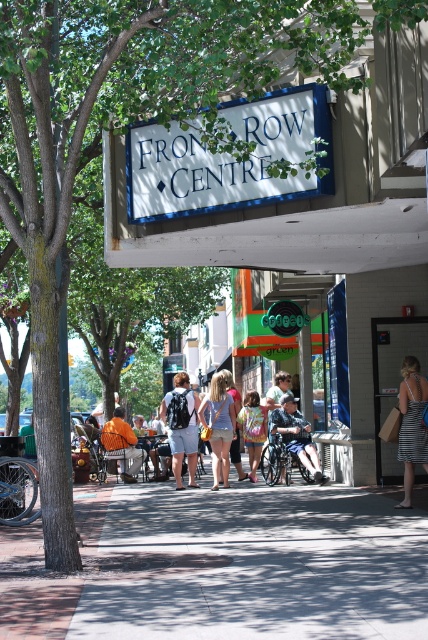
Who is lower down, matte black backpack at center or dark blue fabric wheelchair at center?

Positioned lower is dark blue fabric wheelchair at center.

Between matte black backpack at center and dark blue fabric wheelchair at center, which one appears on the right side from the viewer's perspective?

dark blue fabric wheelchair at center

Which is behind, point (166, 416) or point (281, 435)?

Point (166, 416)

Locate an element on the screen. This screenshot has height=640, width=428. matte black backpack at center is located at coordinates (181, 428).

Which is more to the right, tie-dye shirt at center or denim jacket at center?

Positioned to the right is denim jacket at center.

From the picture: Is tie-dye shirt at center taller than denim jacket at center?

Indeed, tie-dye shirt at center has a greater height compared to denim jacket at center.

Measure the distance between point (252, 476) and camera.

Point (252, 476) and camera are 55.94 feet apart from each other.

Identify the location of tie-dye shirt at center. (252, 429).

Can you confirm if denim shorts at center is positioned below tie-dye shirt at center?

Incorrect, denim shorts at center is not positioned below tie-dye shirt at center.

Is denim shorts at center taller than tie-dye shirt at center?

Indeed, denim shorts at center has a greater height compared to tie-dye shirt at center.

The image size is (428, 640). What do you see at coordinates (219, 426) in the screenshot? I see `denim shorts at center` at bounding box center [219, 426].

Identify the location of denim shorts at center. (219, 426).